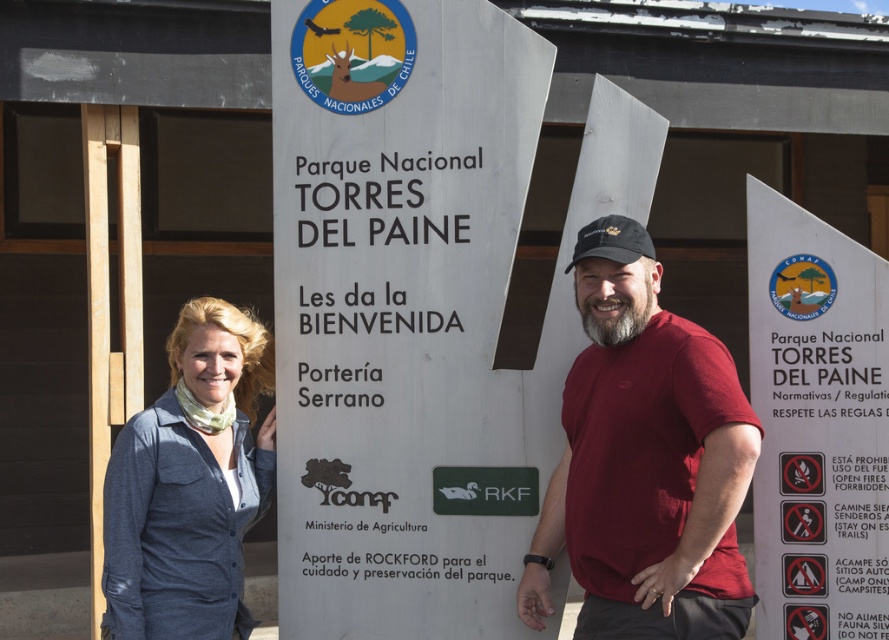
Does silver metallic sign at center have a lesser width compared to white plastic sign at right?

No.

Is point (338, 584) in front of point (861, 321)?

No, it is not.

Does point (499, 464) come farther from viewer compared to point (817, 288)?

Yes, point (499, 464) is farther from viewer.

Where is `silver metallic sign at center`? This screenshot has width=889, height=640. silver metallic sign at center is located at coordinates (399, 314).

Does matte red t-shirt at center appear on the right side of white plastic sign at right?

In fact, matte red t-shirt at center is to the left of white plastic sign at right.

Is point (615, 308) closer to viewer compared to point (845, 516)?

That is True.

Image resolution: width=889 pixels, height=640 pixels. I want to click on matte red t-shirt at center, so click(645, 460).

Is silver metallic sign at center above matte red t-shirt at center?

Yes.

You are a GUI agent. You are given a task and a screenshot of the screen. Output one action in this format:
    pyautogui.click(x=<x>, y=<y>)
    Task: Click on the silver metallic sign at center
    The image size is (889, 640).
    Given the screenshot: What is the action you would take?
    pyautogui.click(x=399, y=314)

I want to click on silver metallic sign at center, so click(399, 314).